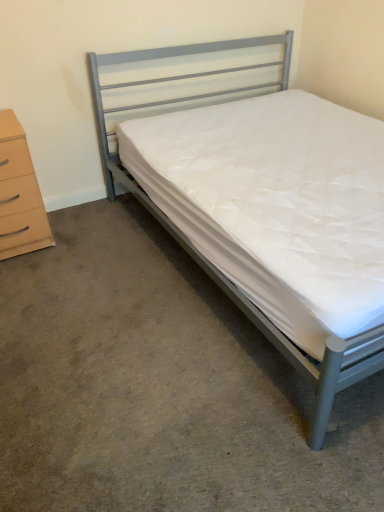
Question: Considering the relative positions of metallic gray bed at center and beige wood chest of drawers at left in the image provided, is metallic gray bed at center to the left of beige wood chest of drawers at left from the viewer's perspective?

Choices:
 (A) yes
 (B) no

Answer: (B)

Question: Is metallic gray bed at center bigger than beige wood chest of drawers at left?

Choices:
 (A) no
 (B) yes

Answer: (B)

Question: From a real-world perspective, is metallic gray bed at center over beige wood chest of drawers at left?

Choices:
 (A) yes
 (B) no

Answer: (A)

Question: Does metallic gray bed at center turn towards beige wood chest of drawers at left?

Choices:
 (A) no
 (B) yes

Answer: (A)

Question: Is metallic gray bed at center smaller than beige wood chest of drawers at left?

Choices:
 (A) yes
 (B) no

Answer: (B)

Question: In terms of height, does beige wood chest of drawers at left look taller or shorter compared to metallic gray bed at center?

Choices:
 (A) short
 (B) tall

Answer: (A)

Question: From the image's perspective, is beige wood chest of drawers at left located above or below metallic gray bed at center?

Choices:
 (A) below
 (B) above

Answer: (A)

Question: Would you say beige wood chest of drawers at left is inside or outside metallic gray bed at center?

Choices:
 (A) outside
 (B) inside

Answer: (A)

Question: Considering the relative positions of beige wood chest of drawers at left and metallic gray bed at center in the image provided, is beige wood chest of drawers at left to the left or to the right of metallic gray bed at center?

Choices:
 (A) left
 (B) right

Answer: (A)

Question: Looking at the image, does metallic gray bed at center seem bigger or smaller compared to beige wood chest of drawers at left?

Choices:
 (A) big
 (B) small

Answer: (A)

Question: From the image's perspective, is metallic gray bed at center located above or below beige wood chest of drawers at left?

Choices:
 (A) below
 (B) above

Answer: (B)

Question: Would you say metallic gray bed at center is to the left or to the right of beige wood chest of drawers at left in the picture?

Choices:
 (A) right
 (B) left

Answer: (A)

Question: Relative to beige wood chest of drawers at left, is metallic gray bed at center in front or behind?

Choices:
 (A) behind
 (B) front

Answer: (B)

Question: Looking at their shapes, would you say metallic gray bed at center is wider or thinner than white quilted mattress at center?

Choices:
 (A) wide
 (B) thin

Answer: (A)

Question: From the image's perspective, relative to white quilted mattress at center, is metallic gray bed at center above or below?

Choices:
 (A) below
 (B) above

Answer: (B)